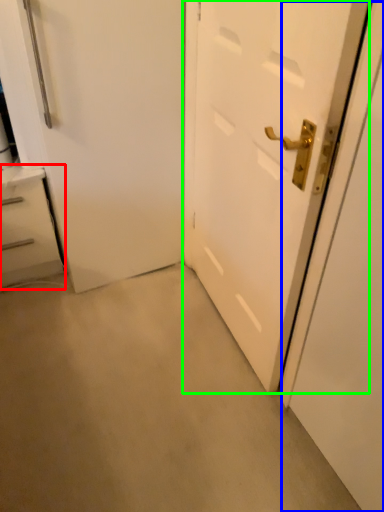
Question: Considering the real-world distances, which object is closest to chest of drawers (highlighted by a red box)? screen door (highlighted by a blue box) or door (highlighted by a green box).

Choices:
 (A) screen door
 (B) door

Answer: (B)